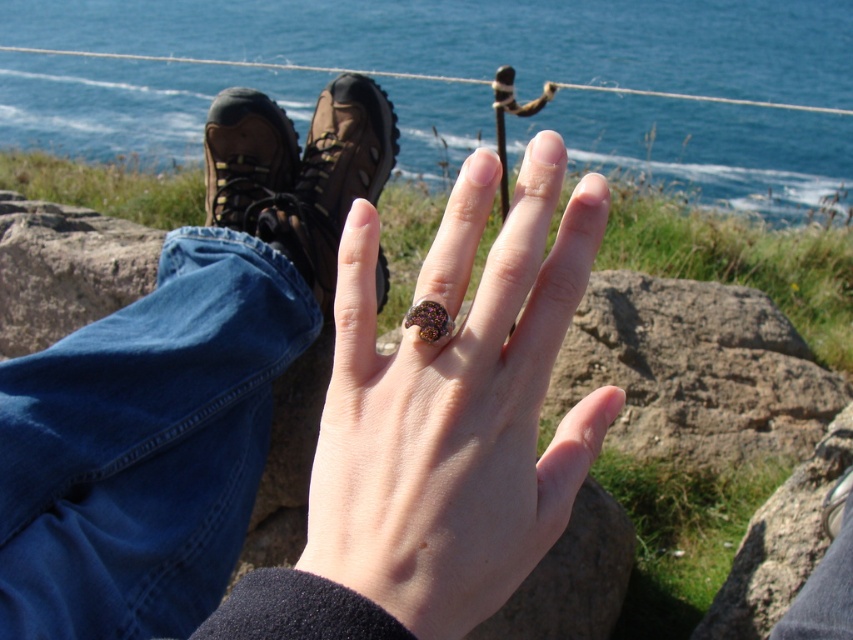
You are a jeweler examining two rings on a customer hand. The customer wants to know which ring is positioned to the right. The rings are the shiny metallic ring at center and the shiny purple gemstone ring at center. Which one is located to the right?

The shiny metallic ring at center is positioned to the right of the shiny purple gemstone ring at center.

Consider the image. You are a photographer trying to capture the shiny metallic ring at center in your shot. The thin rope or cable runs horizontally across the background. To avoid the rope from appearing in the photo, where should you position the ring relative to the rope?

The shiny metallic ring at center is located at point (457, 419). Since the rope is running horizontally across the background, you should position the ring either above or below the rope to avoid it appearing in the photo.